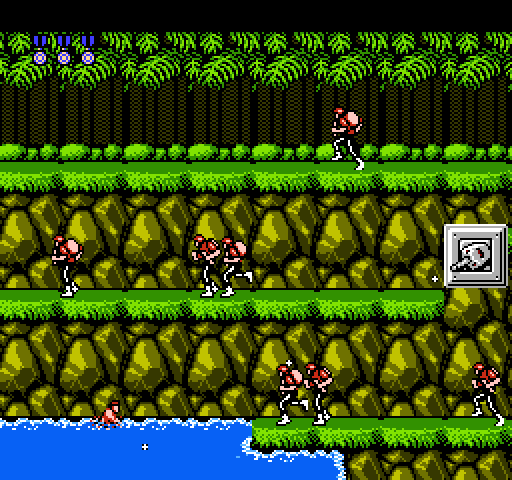
This screenshot has width=512, height=480. What are the coordinates of `shelf` in the screenshot? It's located at (373, 435).